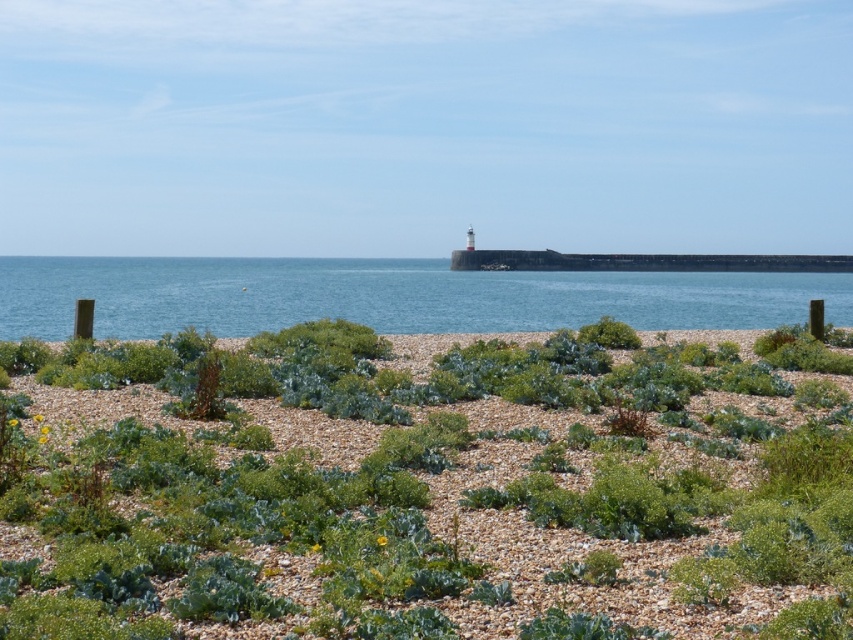
You are standing on the pebble beach and notice the green leafy plant at center and the blue water at center. Which object appears wider from your perspective?

The blue water at center appears wider than the green leafy plant at center because the description states that the green leafy plant at center has a lesser width compared to the blue water at center.

You are standing on the pebble beach and looking out towards the ocean. You notice a green leafy plant at center and a blue water at center. Which object is positioned to the left when viewed from your perspective?

The green leafy plant at center is to the left of the blue water at center from your perspective.

You are standing on the pebble beach and want to take a photo of the green leafy plant at center and the blue water at center. Which object will appear larger in your photo?

The green leafy plant at center will appear larger in the photo because it is closer to the viewer than the blue water at center.